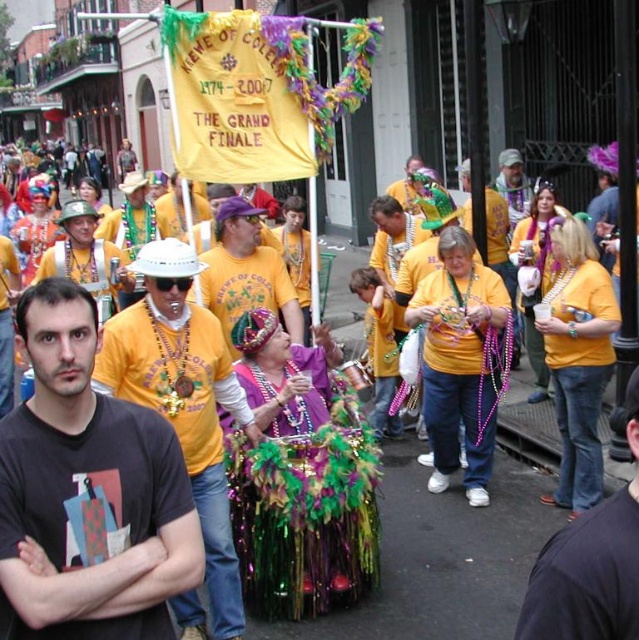
Does black matte t-shirt at center lie in front of matte yellow shirt at center?

Yes, black matte t-shirt at center is closer to the viewer.

Does black matte t-shirt at center appear on the left side of matte yellow shirt at center?

Correct, you'll find black matte t-shirt at center to the left of matte yellow shirt at center.

You are a GUI agent. You are given a task and a screenshot of the screen. Output one action in this format:
    pyautogui.click(x=<x>, y=<y>)
    Task: Click on the black matte t-shirt at center
    The image size is (639, 640).
    Given the screenshot: What is the action you would take?
    pyautogui.click(x=93, y=486)

Find the location of a particular element. This screenshot has width=639, height=640. black matte t-shirt at center is located at coordinates click(93, 486).

Is point (155, 276) farther from camera compared to point (617, 577)?

Yes, point (155, 276) is behind point (617, 577).

Is point (229, 621) positioned before point (617, 628)?

No, (229, 621) is further to viewer.

The image size is (639, 640). I want to click on matte yellow shirt at center, so click(x=183, y=400).

Between black matte t-shirt at center and jeans at right, which one has more height?

With more height is black matte t-shirt at center.

Does black matte t-shirt at center appear over jeans at right?

Yes.

Where is `black matte t-shirt at center`? This screenshot has width=639, height=640. black matte t-shirt at center is located at coordinates (93, 486).